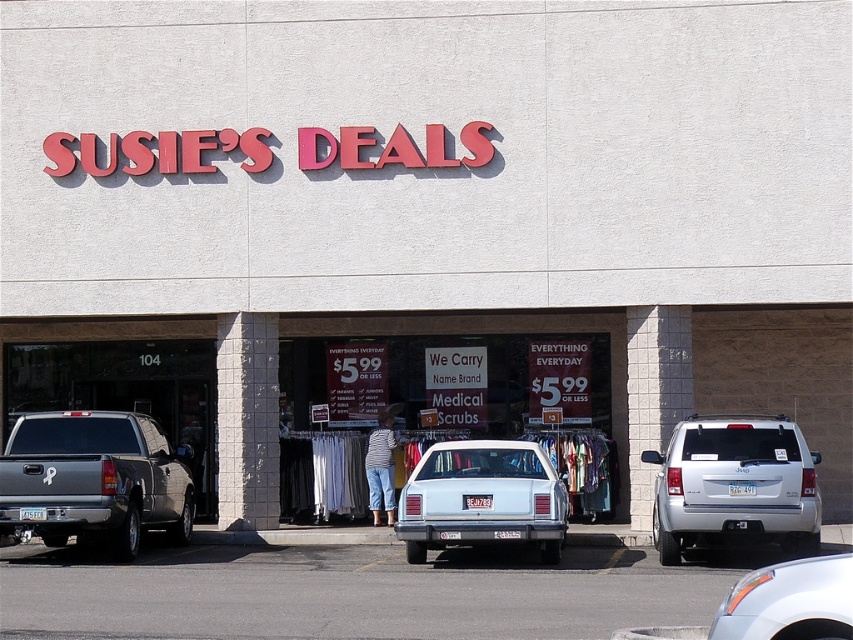
Question: Which point appears closest to the camera in this image?

Choices:
 (A) (769, 624)
 (B) (428, 365)

Answer: (A)

Question: Can you confirm if silver metallic suv at right is thinner than satin silver sedan at center?

Choices:
 (A) yes
 (B) no

Answer: (B)

Question: Based on their relative distances, which object is farther from the white glossy sedan at center?

Choices:
 (A) satin silver sedan at center
 (B) matte gray truck at left

Answer: (A)

Question: Is matte gray truck at left closer to camera compared to silver metallic suv at right?

Choices:
 (A) no
 (B) yes

Answer: (A)

Question: Can you confirm if white cotton clothing at center is positioned above silver metallic suv at right?

Choices:
 (A) yes
 (B) no

Answer: (A)

Question: Estimate the real-world distances between objects in this image. Which object is farther from the white cotton clothing at center?

Choices:
 (A) white glossy sedan at center
 (B) gray asphalt parking lot at lower center
 (C) satin silver sedan at center

Answer: (C)